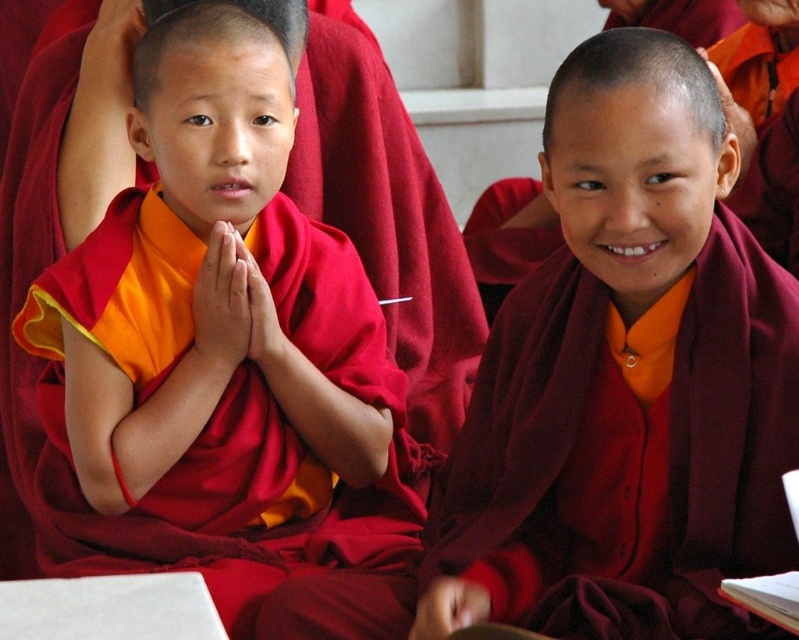
Question: Which of the following is the closest to the observer?

Choices:
 (A) matte red robe at left
 (B) maroon woolen robe at center

Answer: (B)

Question: Is matte red robe at left smaller than maroon woolen robe at center?

Choices:
 (A) yes
 (B) no

Answer: (B)

Question: Which of the following is the farthest from the observer?

Choices:
 (A) (288, 212)
 (B) (487, 586)

Answer: (A)

Question: Does matte red robe at left have a greater width compared to maroon woolen robe at center?

Choices:
 (A) yes
 (B) no

Answer: (A)

Question: Does matte red robe at left appear on the right side of maroon woolen robe at center?

Choices:
 (A) yes
 (B) no

Answer: (B)